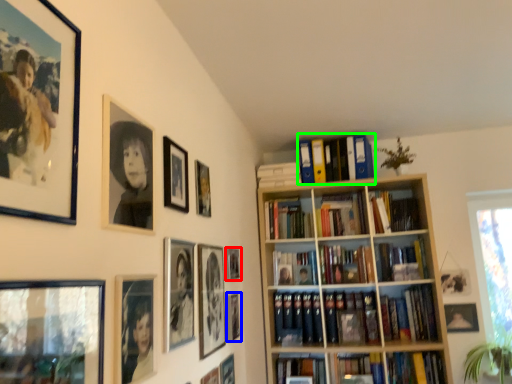
Question: Which object is positioned closest to picture frame (highlighted by a red box)? Select from picture frame (highlighted by a blue box) and book (highlighted by a green box).

Choices:
 (A) picture frame
 (B) book

Answer: (A)